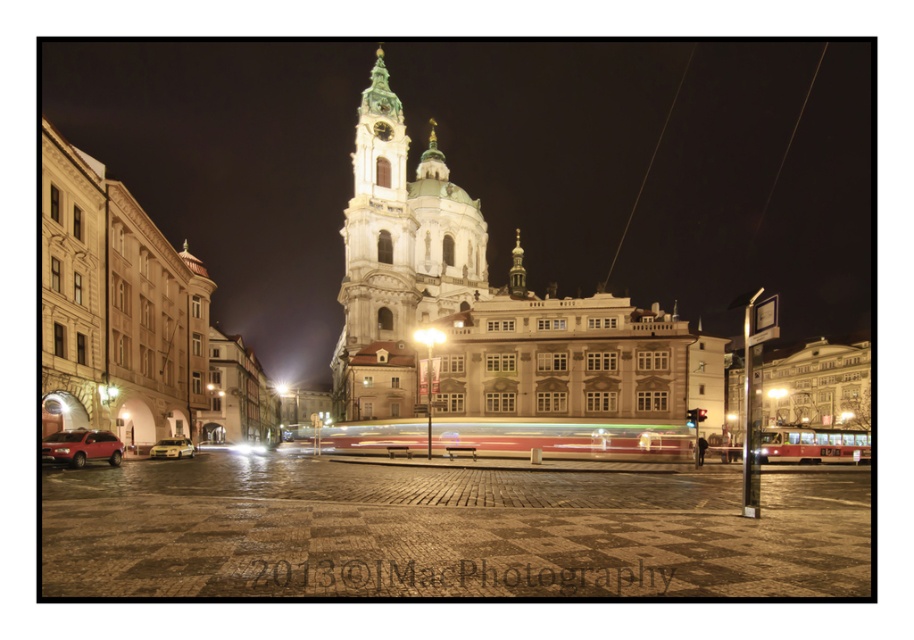
You are standing in the city square and want to take a photo of the white stone church at center. To ensure the church is perfectly centered in your photo, where should you position yourself relative to the church?

You should position yourself directly in front of the white stone church at center, aligned with its central axis to ensure it is perfectly centered in your photo.

You are standing in the city square and want to take a photo of the white stone church at center without the matte red suv at lower left blocking the view. Where should you move to achieve this?

Move closer to the white stone church at center so that it comes forward relative to the matte red suv at lower left, as the church is already further to the viewer than the suv. This positioning will ensure the suv is out of frame or obscured behind the church.